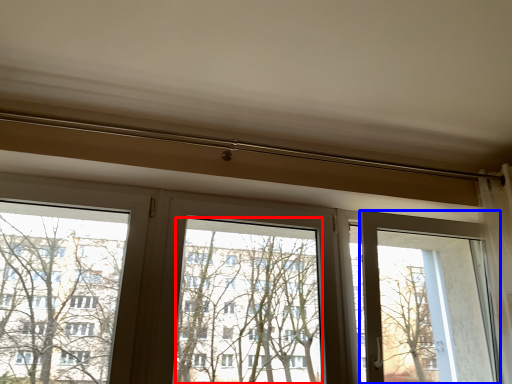
Question: Which point is closer to the camera, window screen (highlighted by a red box) or screen door (highlighted by a blue box)?

Choices:
 (A) window screen
 (B) screen door

Answer: (A)